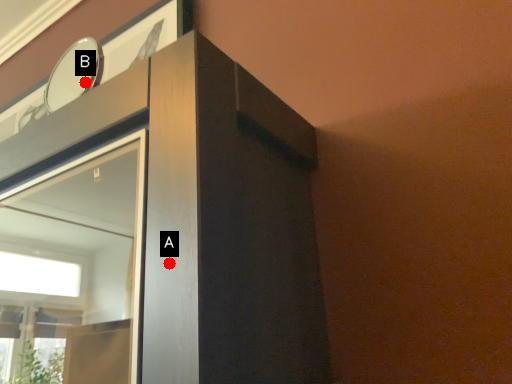
Question: Two points are circled on the image, labeled by A and B beside each circle. Which point is farther to the camera?

Choices:
 (A) A is further
 (B) B is further

Answer: (B)